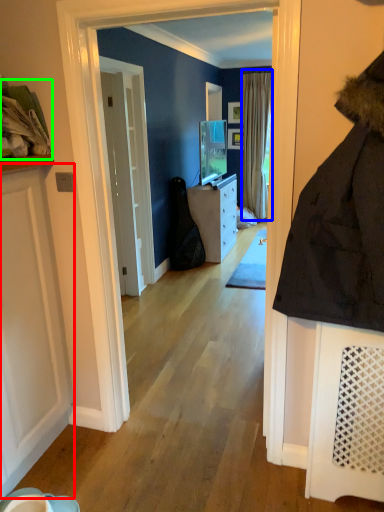
Question: Considering the real-world distances, which object is farthest from door (highlighted by a red box)? curtain (highlighted by a blue box) or laundry (highlighted by a green box)?

Choices:
 (A) curtain
 (B) laundry

Answer: (A)